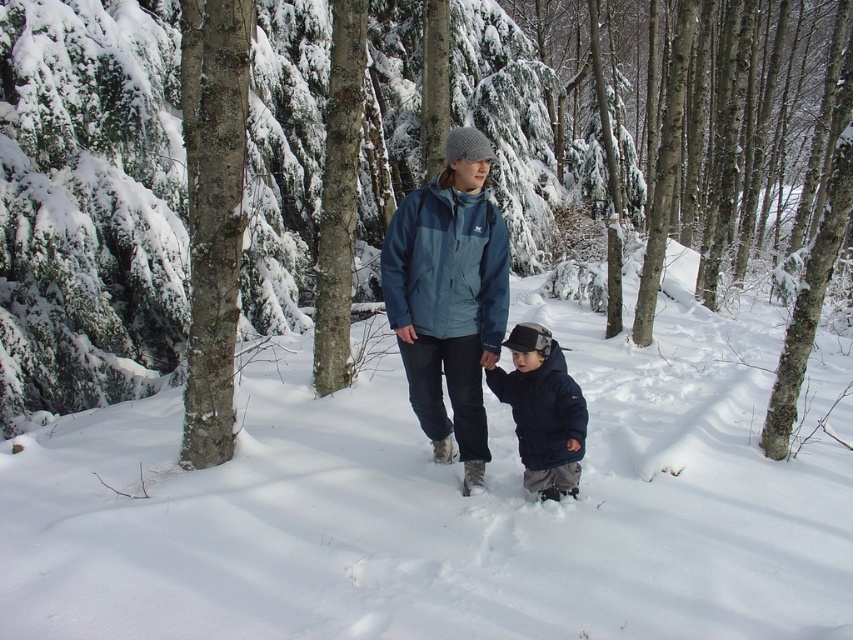
Question: Which object is farther from the camera taking this photo?

Choices:
 (A) white fluffy snow at center
 (B) navy blue fleece jacket at center
 (C) brown rough tree trunk at center
 (D) matte blue jacket at center

Answer: (C)

Question: Is white fluffy snow at center positioned behind matte blue jacket at center?

Choices:
 (A) no
 (B) yes

Answer: (A)

Question: Which object is the closest to the matte blue jacket at center?

Choices:
 (A) brown rough tree trunk at center
 (B) white fluffy snow at center
 (C) smooth bark tree at center

Answer: (C)

Question: Among these objects, which one is nearest to the camera?

Choices:
 (A) matte blue jacket at center
 (B) navy blue fleece jacket at center
 (C) brown rough tree trunk at center

Answer: (B)

Question: Is white fluffy snow at center smaller than matte blue jacket at center?

Choices:
 (A) yes
 (B) no

Answer: (B)

Question: From the image, what is the correct spatial relationship of brown rough tree trunk at center in relation to white fluffy snow at center?

Choices:
 (A) above
 (B) below

Answer: (A)